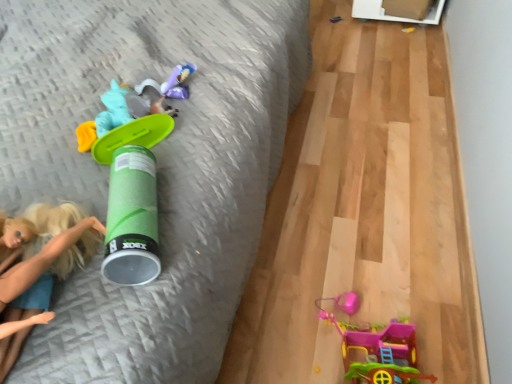
Question: Is plastic pink toy house at lower right, which ranks as the 4th toy in back-to-front order, closer to the viewer compared to green plastic toy at upper left, which is counted as the 1th toy, starting from the left?

Choices:
 (A) no
 (B) yes

Answer: (B)

Question: Is the surface of plastic pink toy house at lower right, which is the fifth toy in top-to-bottom order, in direct contact with green plastic toy at upper left, which is counted as the 1th toy, starting from the left?

Choices:
 (A) yes
 (B) no

Answer: (B)

Question: Can we say plastic pink toy house at lower right, which is the fifth toy in top-to-bottom order, lies outside green plastic toy at upper left, the 5th toy positioned from the right?

Choices:
 (A) yes
 (B) no

Answer: (A)

Question: Can you confirm if plastic pink toy house at lower right, the fourth toy from the left, is shorter than green plastic toy at upper left, which is the third toy from top to bottom?

Choices:
 (A) no
 (B) yes

Answer: (A)

Question: Is plastic pink toy house at lower right, the 2th toy in the front-to-back sequence, bigger than green plastic toy at upper left, the 5th toy positioned from the right?

Choices:
 (A) no
 (B) yes

Answer: (B)

Question: From their relative heights in the image, would you say matte purple plush at center, the fourth toy positioned from the bottom, is taller or shorter than blonde hair doll at left?

Choices:
 (A) tall
 (B) short

Answer: (B)

Question: Looking at their shapes, would you say matte purple plush at center, the fourth toy positioned from the bottom, is wider or thinner than blonde hair doll at left?

Choices:
 (A) wide
 (B) thin

Answer: (B)

Question: From a real-world perspective, is matte purple plush at center, the fourth toy positioned from the bottom, physically located above or below blonde hair doll at left?

Choices:
 (A) above
 (B) below

Answer: (B)

Question: Looking at the image, does matte purple plush at center, which ranks as the fourth toy in right-to-left order, seem bigger or smaller compared to blonde hair doll at left?

Choices:
 (A) big
 (B) small

Answer: (B)

Question: In the image, is matte purple plush at center, the second toy from the left, on the left side or the right side of green plastic toy at upper left, which is counted as the 1th toy, starting from the left?

Choices:
 (A) right
 (B) left

Answer: (A)

Question: From a real-world perspective, is matte purple plush at center, which ranks as the 2th toy in back-to-front order, positioned above or below green plastic toy at upper left, which ranks as the 3th toy in front-to-back order?

Choices:
 (A) above
 (B) below

Answer: (B)

Question: From the image's perspective, is matte purple plush at center, which ranks as the 2th toy in back-to-front order, located above or below green plastic toy at upper left, the 5th toy positioned from the right?

Choices:
 (A) above
 (B) below

Answer: (A)

Question: Considering the positions of matte purple plush at center, which ranks as the 2th toy in back-to-front order, and green plastic toy at upper left, which is counted as the 1th toy, starting from the left, in the image, is matte purple plush at center, which ranks as the 2th toy in back-to-front order, taller or shorter than green plastic toy at upper left, which is counted as the 1th toy, starting from the left,?

Choices:
 (A) tall
 (B) short

Answer: (B)

Question: Is metallic silver toy at upper right, which appears as the 5th toy when ordered from the bottom, taller or shorter than matte purple plush at center, the second toy when ordered from top to bottom?

Choices:
 (A) short
 (B) tall

Answer: (A)

Question: From a real-world perspective, relative to matte purple plush at center, placed as the fourth toy when sorted from front to back, is metallic silver toy at upper right, marked as the 1th toy in a back-to-front arrangement, vertically above or below?

Choices:
 (A) above
 (B) below

Answer: (B)